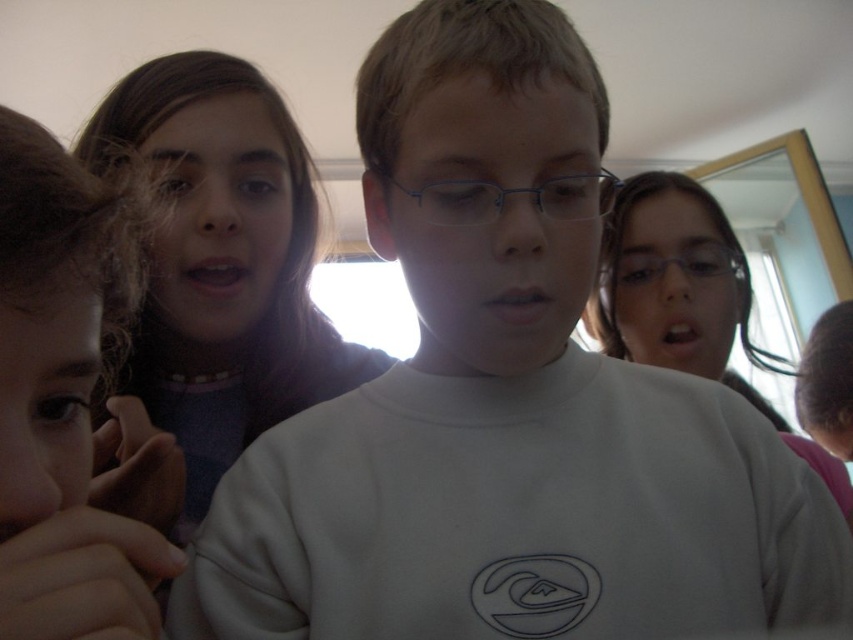
From the picture: You are a photographer trying to capture a closeup of the matte white shirt at center and the metallic blue glasses at center. Since you want both objects to appear the same size in the photo, which object should you move closer to the camera?

The metallic blue glasses at center is smaller than the matte white shirt at center. To make them appear the same size in the photo, you should move the metallic blue glasses at center closer to the camera.

You are a photographer adjusting your camera to focus on two points in the image. The first point is labeled as point (402,189) and the second is point (705,273). Which point should you focus on first if you want to start with the one closer to the camera?

Point (402,189) is closer to the camera than point (705,273), so you should focus on point (402,189) first.